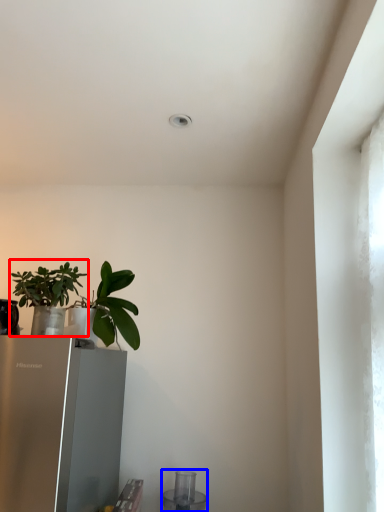
Question: Which object appears farthest to the camera in this image, houseplant (highlighted by a red box) or appliance (highlighted by a blue box)?

Choices:
 (A) houseplant
 (B) appliance

Answer: (B)